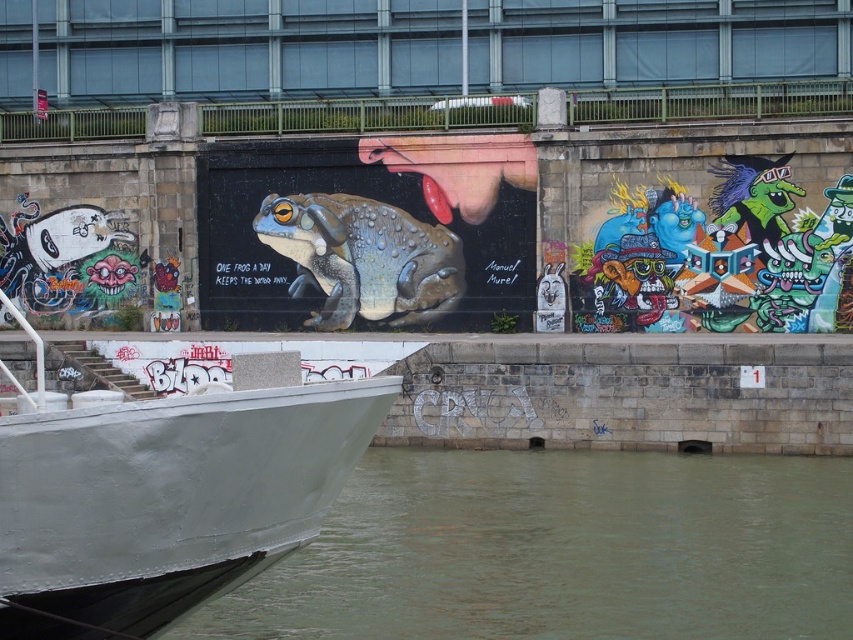
Which of these two, greenish water at lower left or metallic gray boat at center, stands taller?

With more height is metallic gray boat at center.

Who is shorter, greenish water at lower left or metallic gray boat at center?

Standing shorter between the two is greenish water at lower left.

The height and width of the screenshot is (640, 853). I want to click on greenish water at lower left, so click(x=563, y=550).